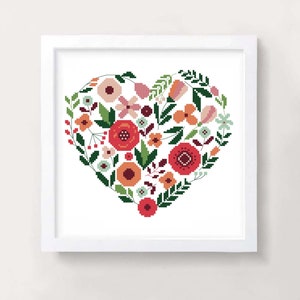
Locate an element on the screen. The height and width of the screenshot is (300, 300). art is located at coordinates (211, 216).